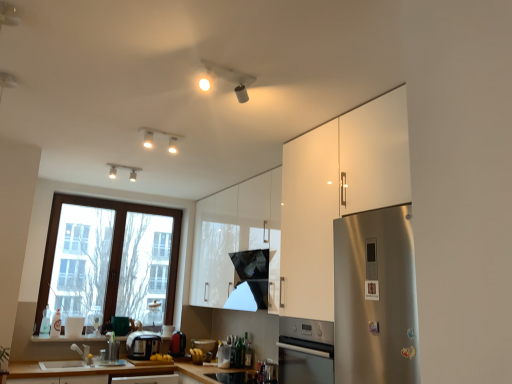
Describe the element at coordinates (249, 355) in the screenshot. I see `translucent glass bottle at center, arranged as the 1th bottle when viewed from the right` at that location.

This screenshot has width=512, height=384. Describe the element at coordinates (142, 344) in the screenshot. I see `satin silver toaster at center, the third appliance from the right` at that location.

Measure the distance between brown wooden window at left and camera.

brown wooden window at left and camera are 4.11 meters apart from each other.

The image size is (512, 384). What do you see at coordinates (111, 250) in the screenshot?
I see `brown wooden window at left` at bounding box center [111, 250].

Locate an element on the screen. translucent glass bottle at lower left, the fourth bottle positioned from the right is located at coordinates (45, 321).

This screenshot has height=384, width=512. I want to click on translucent plastic bottle at window, which appears as the second bottle when viewed from the left, so click(56, 325).

I want to click on translucent glass bottle at center, the fourth bottle from the left, so click(x=249, y=355).

Is satin silver toaster at center, which ranks as the 1th appliance in left-to-right order, in front of or behind white glossy window sill at lower center in the image?

In the image, satin silver toaster at center, which ranks as the 1th appliance in left-to-right order, appears behind white glossy window sill at lower center.

Is satin silver toaster at center, which ranks as the 1th appliance in left-to-right order, wider than white glossy window sill at lower center?

Yes.

Considering the relative positions of satin silver toaster at center, which ranks as the 1th appliance in left-to-right order, and white glossy window sill at lower center in the image provided, is satin silver toaster at center, which ranks as the 1th appliance in left-to-right order, to the left or to the right of white glossy window sill at lower center?

From the image, it's evident that satin silver toaster at center, which ranks as the 1th appliance in left-to-right order, is to the right of white glossy window sill at lower center.

How much distance is there between brown wooden window at left and translucent glass bottle at lower left, the first bottle from the left?

brown wooden window at left and translucent glass bottle at lower left, the first bottle from the left, are 34.26 inches apart from each other.

Is brown wooden window at left not within translucent glass bottle at lower left, the fourth bottle positioned from the right?

brown wooden window at left is positioned outside translucent glass bottle at lower left, the fourth bottle positioned from the right.

Is brown wooden window at left far away from translucent glass bottle at lower left, the fourth bottle positioned from the right?

That's not correct — brown wooden window at left is a little close to translucent glass bottle at lower left, the fourth bottle positioned from the right.

Is brown wooden window at left wider than translucent glass bottle at lower left, the fourth bottle positioned from the right?

No, brown wooden window at left is not wider than translucent glass bottle at lower left, the fourth bottle positioned from the right.

From the image's perspective, is white glossy cabinet at right, marked as the 2th cabinetry in a back-to-front arrangement, over white glossy cabinet at upper center, which appears as the first cabinetry when viewed from the back?

Yes, from the image's perspective, white glossy cabinet at right, marked as the 2th cabinetry in a back-to-front arrangement, is above white glossy cabinet at upper center, which appears as the first cabinetry when viewed from the back.

Is white glossy cabinet at right, the first cabinetry when ordered from front to back, oriented away from white glossy cabinet at upper center, which appears as the first cabinetry when viewed from the back?

No, white glossy cabinet at right, the first cabinetry when ordered from front to back, is not facing away from white glossy cabinet at upper center, which appears as the first cabinetry when viewed from the back.

Between white glossy cabinet at right, the first cabinetry when ordered from front to back, and white glossy cabinet at upper center, the 2th cabinetry positioned from the front, which one appears on the right side from the viewer's perspective?

Positioned to the right is white glossy cabinet at right, the first cabinetry when ordered from front to back.

How different are the orientations of white glossy cabinet at right, the first cabinetry when ordered from front to back, and white glossy cabinet at upper center, which appears as the first cabinetry when viewed from the back, in degrees?

white glossy cabinet at right, the first cabinetry when ordered from front to back, and white glossy cabinet at upper center, which appears as the first cabinetry when viewed from the back, are facing 0.0976 degrees away from each other.

From a real-world perspective, is satin silver toaster at center, which ranks as the 1th appliance in left-to-right order, on top of brown wooden window at left?

Incorrect, from a real-world perspective, satin silver toaster at center, which ranks as the 1th appliance in left-to-right order, is lower than brown wooden window at left.

Is satin silver toaster at center, the third appliance from the right, positioned behind brown wooden window at left?

No, the depth of satin silver toaster at center, the third appliance from the right, is less than that of brown wooden window at left.

Which object is thinner, satin silver toaster at center, the third appliance from the right, or brown wooden window at left?

Thinner between the two is brown wooden window at left.

Is glossy black exhaust hood at center far from matte silver faucet at lower left?

Yes, glossy black exhaust hood at center and matte silver faucet at lower left are quite far apart.

Which object is further away from the camera, glossy black exhaust hood at center or matte silver faucet at lower left?

matte silver faucet at lower left is behind.

Does point (252, 291) appear closer or farther from the camera than point (87, 359)?

Point (252, 291) appears to be closer to the viewer than point (87, 359).

Considering the relative sizes of white glossy window sill at lower center and green glass bottle at lower center, acting as the 3th bottle starting from the left, in the image provided, is white glossy window sill at lower center thinner than green glass bottle at lower center, acting as the 3th bottle starting from the left,?

No, white glossy window sill at lower center is not thinner than green glass bottle at lower center, acting as the 3th bottle starting from the left.

Would you consider white glossy window sill at lower center to be distant from green glass bottle at lower center, arranged as the 2th bottle when viewed from the right?

Yes.

Based on the photo, from the image's perspective, is white glossy window sill at lower center positioned above or below green glass bottle at lower center, acting as the 3th bottle starting from the left?

From the image's perspective, white glossy window sill at lower center appears above green glass bottle at lower center, acting as the 3th bottle starting from the left.

Is matte silver faucet at lower left at the left side of translucent glass bottle at lower left, the first bottle from the left?

No.

Locate an element on the screen. bottle that is the 4th one when counting backward from the matte silver faucet at lower left is located at coordinates pyautogui.click(x=45, y=321).

From their relative heights in the image, would you say matte silver faucet at lower left is taller or shorter than translucent glass bottle at lower left, the first bottle from the left?

In the image, matte silver faucet at lower left appears to be shorter than translucent glass bottle at lower left, the first bottle from the left.

From the image's perspective, is matte silver faucet at lower left located above or below translucent glass bottle at lower left, the fourth bottle positioned from the right?

Based on their image positions, matte silver faucet at lower left is located beneath translucent glass bottle at lower left, the fourth bottle positioned from the right.

This screenshot has width=512, height=384. What are the coordinates of `window sill located above the satin silver toaster at center, the third appliance from the right (from the image's perspective)` in the screenshot? It's located at (67, 338).

The width and height of the screenshot is (512, 384). Find the location of `bottle that is the 2nd object located below the brown wooden window at left (from the image's perspective)`. bottle that is the 2nd object located below the brown wooden window at left (from the image's perspective) is located at coordinates (45, 321).

Which object lies nearer to the anchor point glossy black exhaust hood at center, white glossy cabinet at upper center, which appears as the first cabinetry when viewed from the back, or translucent glass bottle at center, the fourth bottle from the left?

white glossy cabinet at upper center, which appears as the first cabinetry when viewed from the back.

Estimate the real-world distances between objects in this image. Which object is further from matte silver faucet at lower left, white glossy cabinet at upper center, the 2th cabinetry positioned from the front, or translucent plastic container at center, positioned as the first appliance in right-to-left order?

white glossy cabinet at upper center, the 2th cabinetry positioned from the front, lies further to matte silver faucet at lower left than the other object.

Based on the photo, looking at the image, which one is located further to green glass bottle at lower center, arranged as the 2th bottle when viewed from the right, white glossy cabinet at upper center, the 2th cabinetry positioned from the front, or brown wooden window at left?

brown wooden window at left is further to green glass bottle at lower center, arranged as the 2th bottle when viewed from the right.

Looking at the image, which one is located closer to green glass bottle at lower center, acting as the 3th bottle starting from the left, white glossy cabinet at right, marked as the 2th cabinetry in a back-to-front arrangement, or matte black kettle at lower center, the second appliance when ordered from right to left?

matte black kettle at lower center, the second appliance when ordered from right to left, is positioned closer to the anchor green glass bottle at lower center, acting as the 3th bottle starting from the left.

Looking at the image, which one is located closer to white glossy cabinet at right, marked as the 2th cabinetry in a back-to-front arrangement, white glossy cabinet at upper center, which appears as the first cabinetry when viewed from the back, or green glass bottle at lower center, acting as the 3th bottle starting from the left?

white glossy cabinet at upper center, which appears as the first cabinetry when viewed from the back, is closer to white glossy cabinet at right, marked as the 2th cabinetry in a back-to-front arrangement.

In the scene shown: When comparing their distances from white glossy cabinet at upper center, the 2th cabinetry positioned from the front, does translucent plastic bottle at window, the 3th bottle from the right, or satin silver toaster at center, the third appliance from the right, seem further?

Among the two, translucent plastic bottle at window, the 3th bottle from the right, is located further to white glossy cabinet at upper center, the 2th cabinetry positioned from the front.

Based on their spatial positions, is translucent plastic bottle at window, the 3th bottle from the right, or white glossy cabinet at upper center, which appears as the first cabinetry when viewed from the back, closer to brown wooden window at left?

translucent plastic bottle at window, the 3th bottle from the right, is positioned closer to the anchor brown wooden window at left.

Looking at this image, when comparing their distances from translucent glass bottle at center, the fourth bottle from the left, does green glass bottle at lower center, arranged as the 2th bottle when viewed from the right, or white glossy cabinet at upper center, the 2th cabinetry positioned from the front, seem further?

Among the two, white glossy cabinet at upper center, the 2th cabinetry positioned from the front, is located further to translucent glass bottle at center, the fourth bottle from the left.

Find the location of a particular element. cabinetry between translucent plastic bottle at window, which appears as the second bottle when viewed from the left, and translucent glass bottle at center, arranged as the 1th bottle when viewed from the right, in the horizontal direction is located at coordinates (233, 233).

Where is `exhaust hood between white glossy cabinet at upper center, the 2th cabinetry positioned from the front, and green glass bottle at lower center, arranged as the 2th bottle when viewed from the right, in the up-down direction`? The width and height of the screenshot is (512, 384). exhaust hood between white glossy cabinet at upper center, the 2th cabinetry positioned from the front, and green glass bottle at lower center, arranged as the 2th bottle when viewed from the right, in the up-down direction is located at coordinates (250, 280).

You are a GUI agent. You are given a task and a screenshot of the screen. Output one action in this format:
    pyautogui.click(x=<x>, y=<y>)
    Task: Click on the appliance between matte silver faucet at lower left and matte black kettle at lower center, the second appliance viewed from the left, in the horizontal direction
    The width and height of the screenshot is (512, 384).
    Given the screenshot: What is the action you would take?
    pyautogui.click(x=142, y=344)

Where is `faucet between translucent glass bottle at lower left, the first bottle from the left, and white glossy window sill at lower center from left to right`? Image resolution: width=512 pixels, height=384 pixels. faucet between translucent glass bottle at lower left, the first bottle from the left, and white glossy window sill at lower center from left to right is located at coordinates (83, 352).